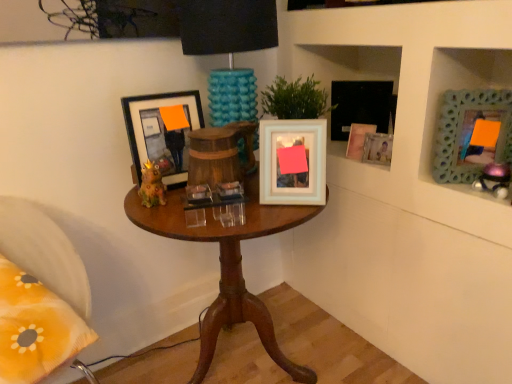
Question: In terms of width, does green textured frame at upper right, marked as the sixth picture frame in a left-to-right arrangement, look wider or thinner when compared to matte ceramic frog at center, arranged as the 2th toy when viewed from the right?

Choices:
 (A) thin
 (B) wide

Answer: (B)

Question: Considering the positions of green textured frame at upper right, marked as the sixth picture frame in a left-to-right arrangement, and matte ceramic frog at center, the first toy in the left-to-right sequence, in the image, is green textured frame at upper right, marked as the sixth picture frame in a left-to-right arrangement, taller or shorter than matte ceramic frog at center, the first toy in the left-to-right sequence,?

Choices:
 (A) tall
 (B) short

Answer: (A)

Question: Based on their relative distances, which object is nearer to the matte white picture frame at upper right, the 3th picture frame viewed from the left?

Choices:
 (A) yellow fabric pillow at lower left
 (B) matte ceramic frog at center, arranged as the 2th toy when viewed from the right
 (C) matte white picture frame at upper right, which is the 5th picture frame in left-to-right order
 (D) white glossy picture frame at center, positioned as the second picture frame in left-to-right order
 (E) metallic purple toy at upper right, the second toy viewed from the left

Answer: (C)

Question: Estimate the real-world distances between objects in this image. Which object is closer to the metallic purple toy at upper right, placed as the first toy when sorted from right to left?

Choices:
 (A) white glossy picture frame at center, arranged as the fifth picture frame when viewed from the right
 (B) green textured frame at upper right, the 1th picture frame when ordered from right to left
 (C) matte black picture frame at upper right, which is the fourth picture frame in left-to-right order
 (D) matte ceramic frog at center, arranged as the 2th toy when viewed from the right
 (E) teal textured lampshade at center

Answer: (B)